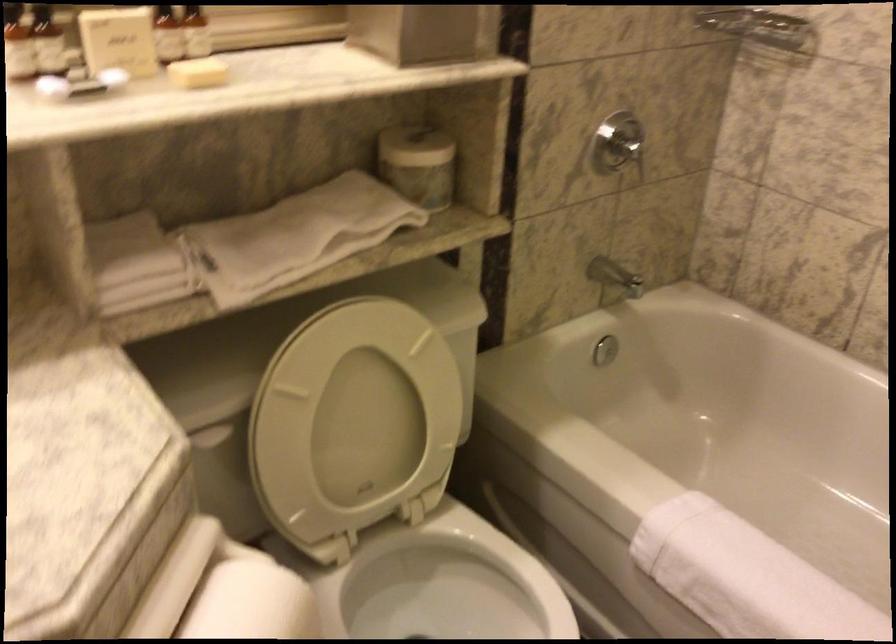
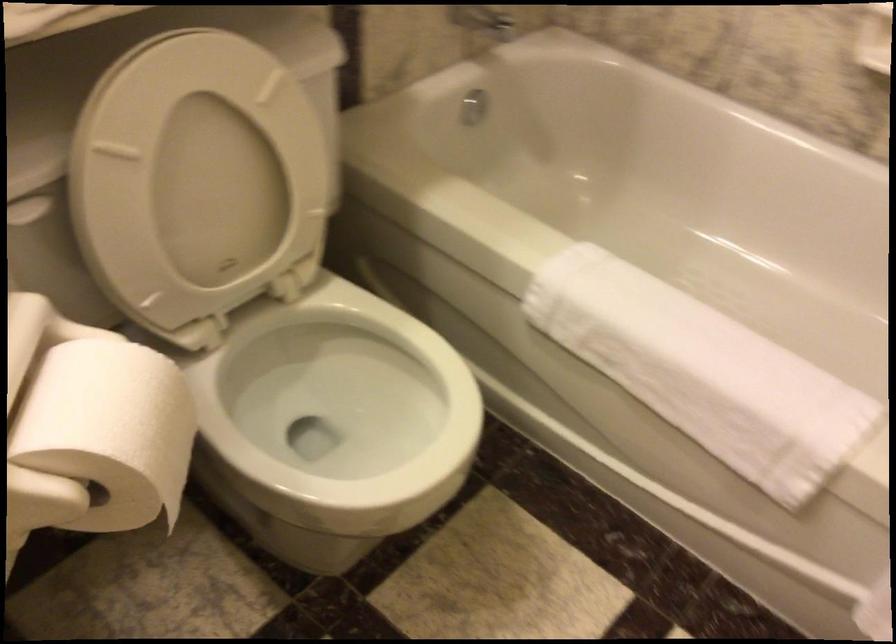
Question: What movement of the cameraman would produce the second image?

Choices:
 (A) Left
 (B) Right
 (C) Forward
 (D) Backward

Answer: (C)